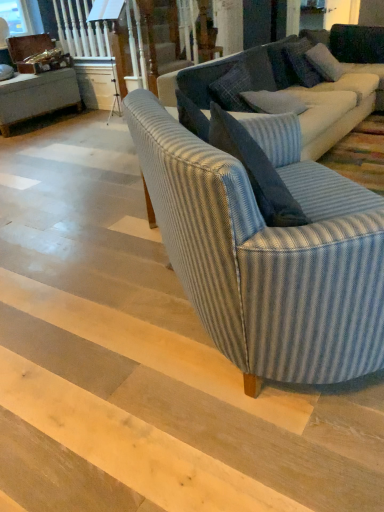
Question: Should I look upward or downward to see blue textured pillow at upper right, placed as the first pillow when sorted from back to front?

Choices:
 (A) down
 (B) up

Answer: (B)

Question: Can you confirm if blue textured pillow at upper right, the 3th pillow viewed from the front, is positioned to the right of blue striped fabric armchair at center?

Choices:
 (A) yes
 (B) no

Answer: (A)

Question: Is blue striped fabric armchair at center inside blue textured pillow at upper right, placed as the first pillow when sorted from back to front?

Choices:
 (A) yes
 (B) no

Answer: (B)

Question: Is blue textured pillow at upper right, placed as the first pillow when sorted from back to front, further to the viewer compared to blue striped fabric armchair at center?

Choices:
 (A) yes
 (B) no

Answer: (A)

Question: From the image's perspective, is blue textured pillow at upper right, placed as the first pillow when sorted from back to front, over blue striped fabric armchair at center?

Choices:
 (A) yes
 (B) no

Answer: (A)

Question: Considering the relative positions of blue textured pillow at upper right, placed as the first pillow when sorted from back to front, and blue striped fabric armchair at center in the image provided, is blue textured pillow at upper right, placed as the first pillow when sorted from back to front, to the left of blue striped fabric armchair at center from the viewer's perspective?

Choices:
 (A) no
 (B) yes

Answer: (A)

Question: Is blue textured pillow at upper right, the 3th pillow viewed from the front, closer to camera compared to blue striped fabric armchair at center?

Choices:
 (A) no
 (B) yes

Answer: (A)

Question: Considering the relative sizes of blue textured pillow at center, which is counted as the 1th pillow, starting from the front, and blue striped fabric couch at center, which is the 2th studio couch in back-to-front order, in the image provided, is blue textured pillow at center, which is counted as the 1th pillow, starting from the front, smaller than blue striped fabric couch at center, which is the 2th studio couch in back-to-front order,?

Choices:
 (A) no
 (B) yes

Answer: (B)

Question: Considering the relative sizes of blue textured pillow at center, which is counted as the 1th pillow, starting from the front, and blue striped fabric couch at center, placed as the 1th studio couch when sorted from front to back, in the image provided, is blue textured pillow at center, which is counted as the 1th pillow, starting from the front, thinner than blue striped fabric couch at center, placed as the 1th studio couch when sorted from front to back,?

Choices:
 (A) yes
 (B) no

Answer: (A)

Question: Can you confirm if blue textured pillow at center, placed as the 3th pillow when sorted from back to front, is bigger than blue striped fabric couch at center, which is the 2th studio couch in back-to-front order?

Choices:
 (A) no
 (B) yes

Answer: (A)

Question: Is blue textured pillow at center, placed as the 3th pillow when sorted from back to front, completely or partially outside of blue striped fabric couch at center, placed as the 1th studio couch when sorted from front to back?

Choices:
 (A) no
 (B) yes

Answer: (B)

Question: Can you confirm if blue textured pillow at center, placed as the 3th pillow when sorted from back to front, is positioned to the left of blue striped fabric couch at center, placed as the 1th studio couch when sorted from front to back?

Choices:
 (A) no
 (B) yes

Answer: (A)

Question: Does blue textured pillow at center, which is counted as the 1th pillow, starting from the front, have a lesser height compared to blue striped fabric couch at center, placed as the 1th studio couch when sorted from front to back?

Choices:
 (A) no
 (B) yes

Answer: (B)

Question: Can you confirm if blue striped fabric couch at center, which is the 1th studio couch in back-to-front order, is taller than blue textured pillow at upper right, the second pillow in the front-to-back sequence?

Choices:
 (A) yes
 (B) no

Answer: (A)